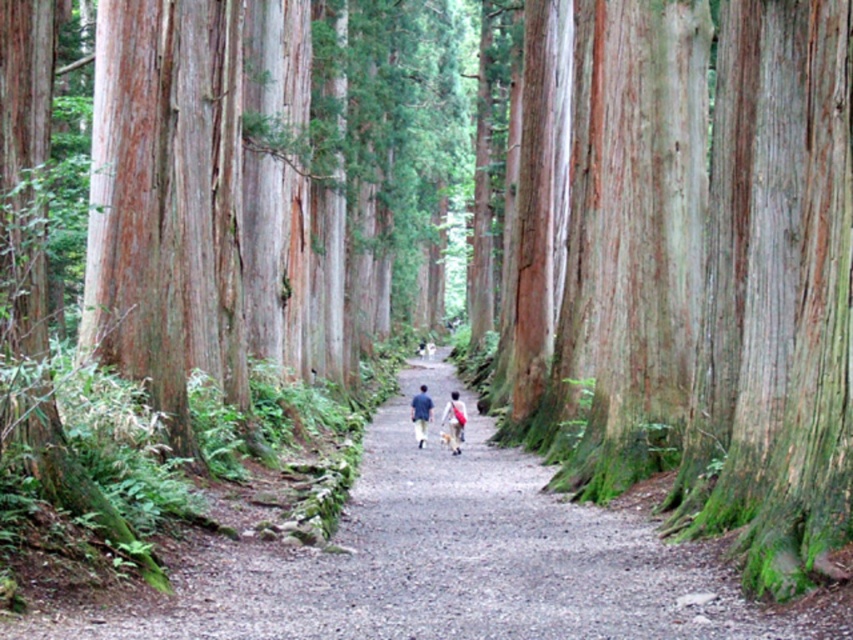
Is light blue fabric at center behind blue fabric person at center?

No, light blue fabric at center is closer to the viewer.

Can you confirm if light blue fabric at center is positioned below blue fabric person at center?

Actually, light blue fabric at center is above blue fabric person at center.

You are a GUI agent. You are given a task and a screenshot of the screen. Output one action in this format:
    pyautogui.click(x=<x>, y=<y>)
    Task: Click on the light blue fabric at center
    
    Given the screenshot: What is the action you would take?
    pyautogui.click(x=453, y=420)

Locate an element on the screen. This screenshot has width=853, height=640. light blue fabric at center is located at coordinates (453, 420).

Which is behind, point (300, 616) or point (426, 394)?

Positioned behind is point (426, 394).

The height and width of the screenshot is (640, 853). In order to click on dirt path at center in this screenshot , I will do `click(454, 563)`.

Is point (170, 616) behind point (421, 397)?

No, (170, 616) is closer to viewer.

At what (x,y) coordinates should I click in order to perform the action: click on dirt path at center. Please return your answer as a coordinate pair (x, y). Looking at the image, I should click on (454, 563).

Is dirt path at center to the right of light blue fabric at center from the viewer's perspective?

No, dirt path at center is not to the right of light blue fabric at center.

This screenshot has width=853, height=640. I want to click on dirt path at center, so click(x=454, y=563).

Describe the element at coordinates (454, 563) in the screenshot. I see `dirt path at center` at that location.

Find the location of a particular element. Image resolution: width=853 pixels, height=640 pixels. dirt path at center is located at coordinates (454, 563).